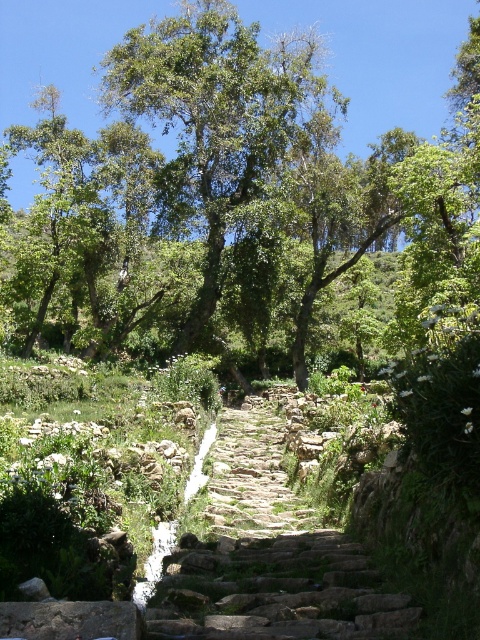
You are planning to take a photo of the green leafy tree at upper center and the rusty stone stairs at center. Which object should you focus on first if you want to capture both in a single frame without moving the camera?

You should focus on the green leafy tree at upper center first because it is wider than the rusty stone stairs at center, so positioning the camera to include its entire width will naturally include the narrower stairs as well.

You are standing at the base of the stone staircase and want to reach the green leafy tree at upper center. Based on the coordinates provided in the description, can you determine the direction you should head to reach it?

The green leafy tree at upper center is located at point (215, 118), which means it is positioned to the upper part of the image. Therefore, you should head upwards along the stone staircase to reach it.

You are standing at the bottom of the stone staircase and want to reach the green leafy tree at center. Which direction should you move relative to the staircase?

You should move towards the center of the image to reach the green leafy tree at center, as it is located at point (377, 54).